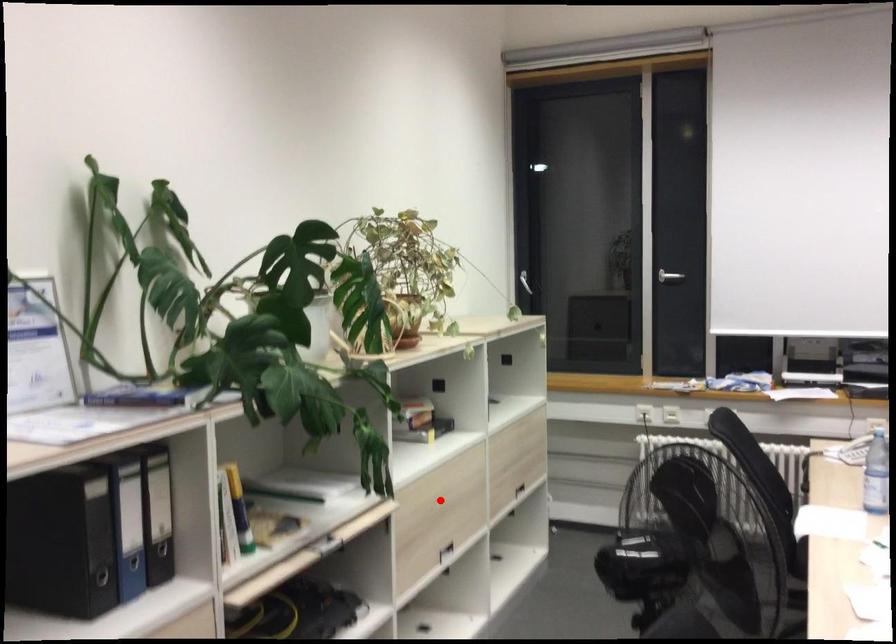
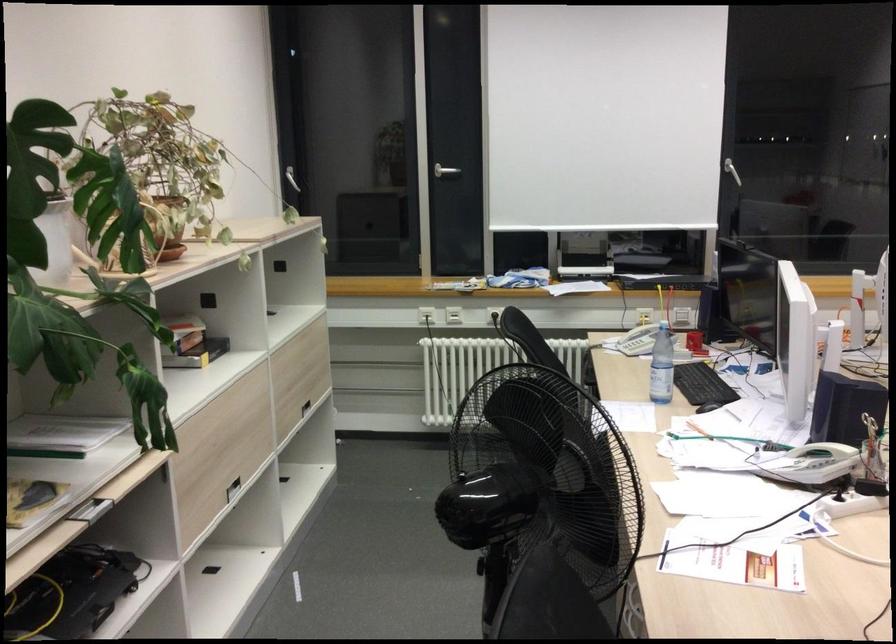
Find the pixel in the second image that matches the highlighted location in the first image.

(225, 435)